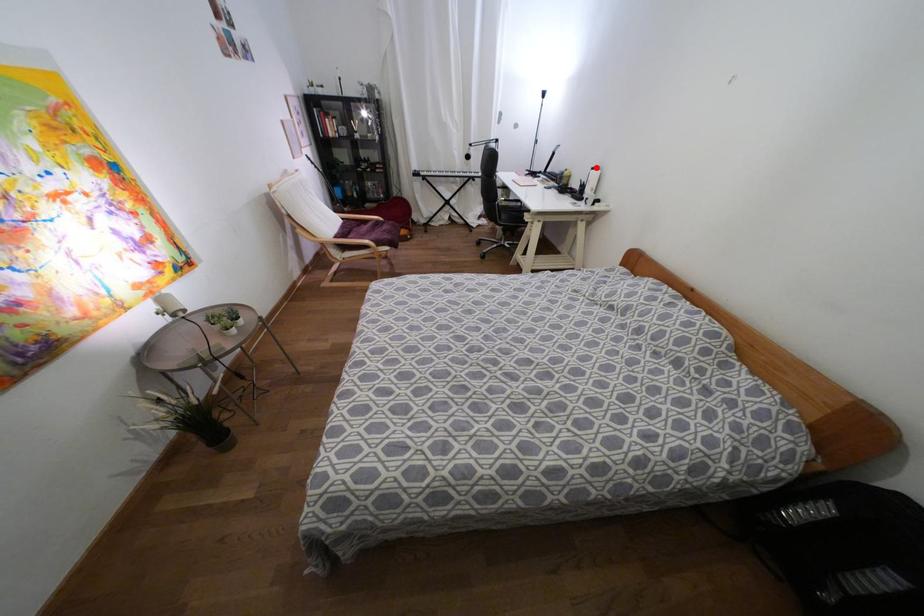
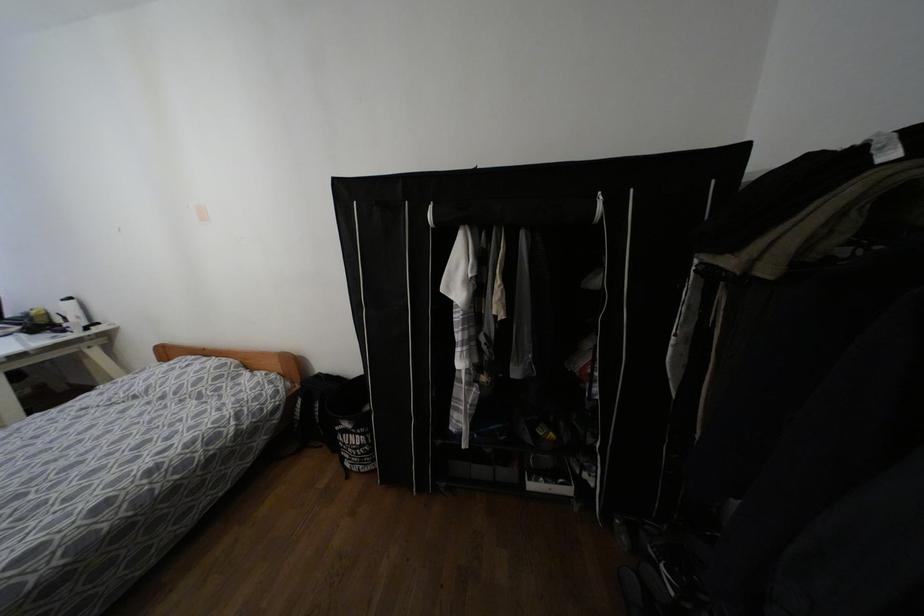
Where in the second image is the point corresponding to the highlighted location from the first image?

(68, 299)